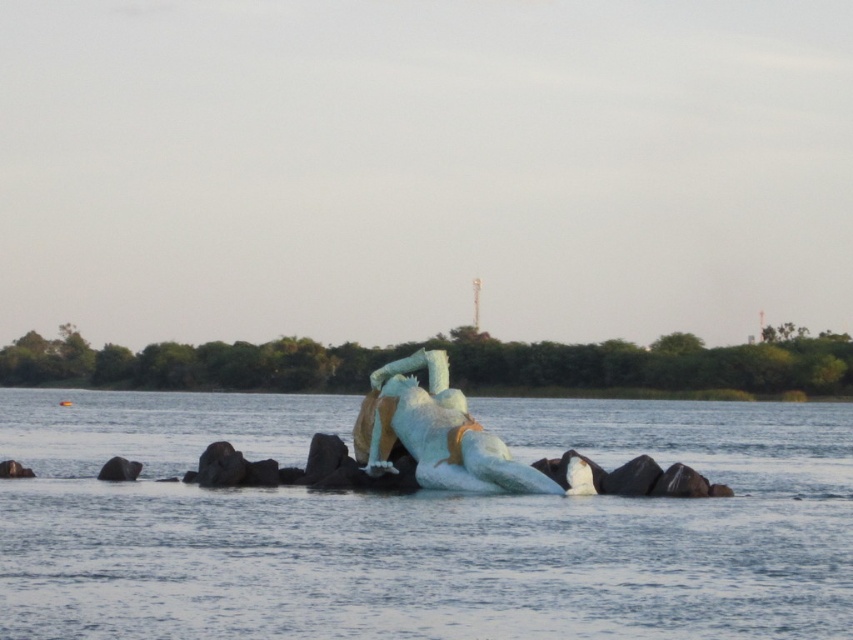
In the scene shown: You are a swimmer approaching the sculpture in the water. The sculpture is white matte sculpture at center and the water around it is translucent white water at center. Can you tell me which one is higher above the water surface?

The translucent white water at center is taller than the white matte sculpture at center, meaning the water is higher above the water surface than the sculpture.

You are an artist planning to paint the scene. You want to ensure the translucent white water at center and the white matte sculpture at center are placed correctly in your painting. According to the scene, which object is located to the left of the other?

The translucent white water at center is positioned on the left side of white matte sculpture at center.